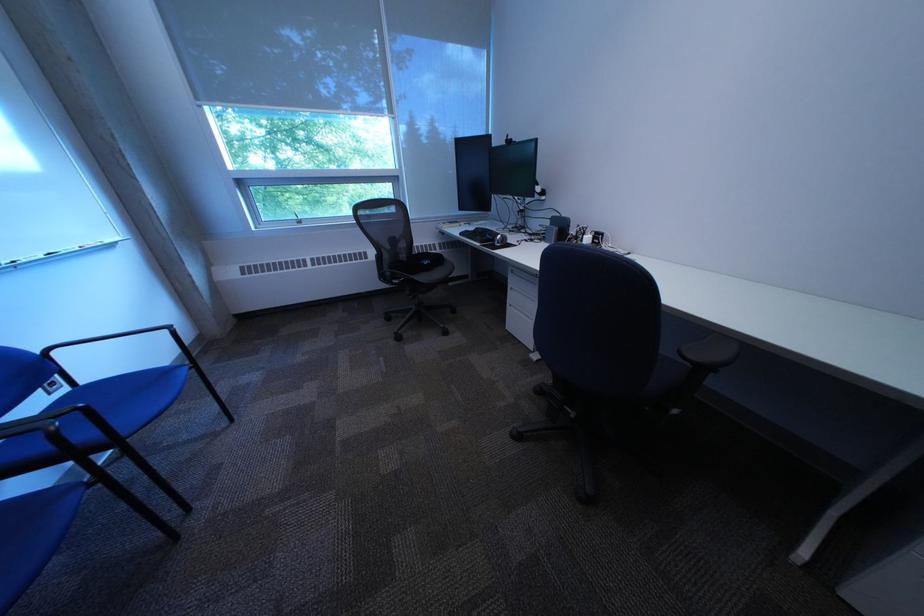
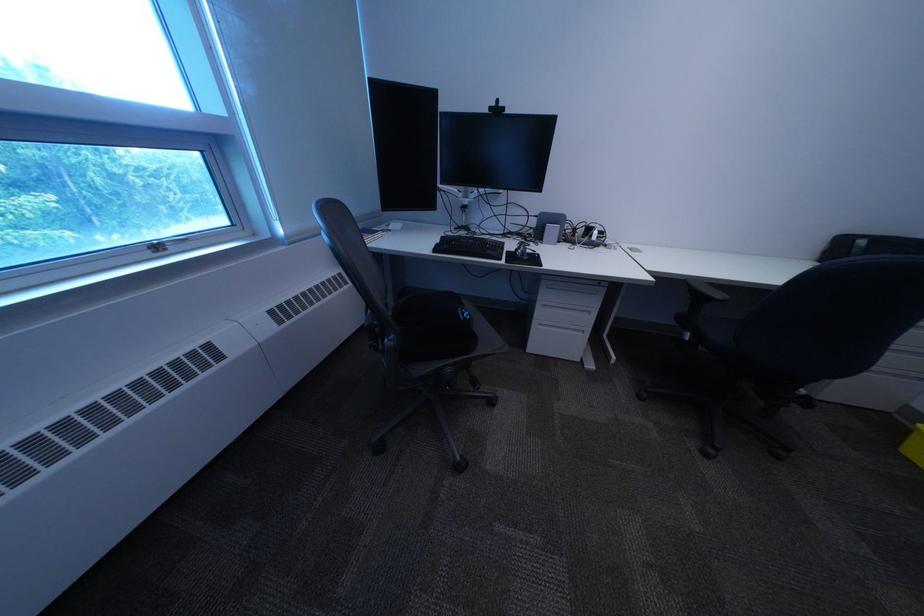
In the second image, find the point that corresponds to [527,290] in the first image.

(558, 307)